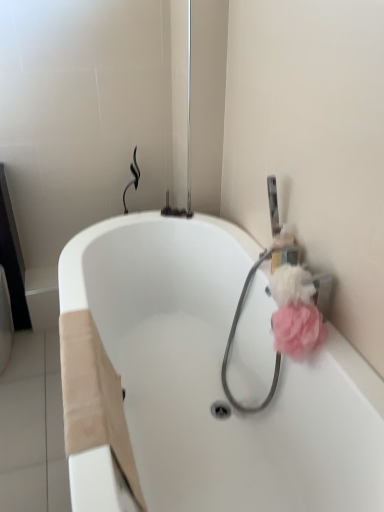
Question: Does white glossy bathtub at center appear on the left side of pink fluffy sponge at right, the 1th flower ordered from the bottom?

Choices:
 (A) yes
 (B) no

Answer: (A)

Question: Are white glossy bathtub at center and pink fluffy sponge at right, arranged as the 2th flower when viewed from the top, located far from each other?

Choices:
 (A) yes
 (B) no

Answer: (B)

Question: From the image's perspective, is white glossy bathtub at center under pink fluffy sponge at right, arranged as the 2th flower when viewed from the top?

Choices:
 (A) no
 (B) yes

Answer: (B)

Question: Considering the relative positions of white glossy bathtub at center and pink fluffy sponge at right, arranged as the 2th flower when viewed from the top, in the image provided, is white glossy bathtub at center to the right of pink fluffy sponge at right, arranged as the 2th flower when viewed from the top, from the viewer's perspective?

Choices:
 (A) no
 (B) yes

Answer: (A)

Question: Considering the relative sizes of white glossy bathtub at center and pink fluffy sponge at right, the 1th flower ordered from the bottom, in the image provided, is white glossy bathtub at center thinner than pink fluffy sponge at right, the 1th flower ordered from the bottom,?

Choices:
 (A) no
 (B) yes

Answer: (A)

Question: Is point (173, 429) positioned closer to the camera than point (238, 315)?

Choices:
 (A) farther
 (B) closer

Answer: (B)

Question: Which is correct: white glossy bathtub at center is inside pink fabric garden hose at upper right, or outside of it?

Choices:
 (A) outside
 (B) inside

Answer: (A)

Question: Considering the positions of white glossy bathtub at center and pink fabric garden hose at upper right in the image, is white glossy bathtub at center bigger or smaller than pink fabric garden hose at upper right?

Choices:
 (A) big
 (B) small

Answer: (A)

Question: From their relative heights in the image, would you say white glossy bathtub at center is taller or shorter than pink fabric garden hose at upper right?

Choices:
 (A) tall
 (B) short

Answer: (A)

Question: From a real-world perspective, is pink fabric garden hose at upper right above or below pink fluffy sponge at right, which appears as the 1th flower when viewed from the top?

Choices:
 (A) above
 (B) below

Answer: (B)

Question: Is pink fabric garden hose at upper right inside or outside of pink fluffy sponge at right, which appears as the 1th flower when viewed from the top?

Choices:
 (A) outside
 (B) inside

Answer: (A)

Question: From the image's perspective, relative to pink fluffy sponge at right, placed as the 2th flower when sorted from bottom to top, is pink fabric garden hose at upper right above or below?

Choices:
 (A) below
 (B) above

Answer: (A)

Question: Looking at the image, does pink fabric garden hose at upper right seem bigger or smaller compared to pink fluffy sponge at right, which appears as the 1th flower when viewed from the top?

Choices:
 (A) big
 (B) small

Answer: (A)

Question: Is pink fabric garden hose at upper right inside the boundaries of pink fluffy sponge at right, arranged as the 2th flower when viewed from the top, or outside?

Choices:
 (A) inside
 (B) outside

Answer: (B)

Question: Considering the positions of pink fabric garden hose at upper right and pink fluffy sponge at right, the 1th flower ordered from the bottom, in the image, is pink fabric garden hose at upper right bigger or smaller than pink fluffy sponge at right, the 1th flower ordered from the bottom,?

Choices:
 (A) small
 (B) big

Answer: (B)